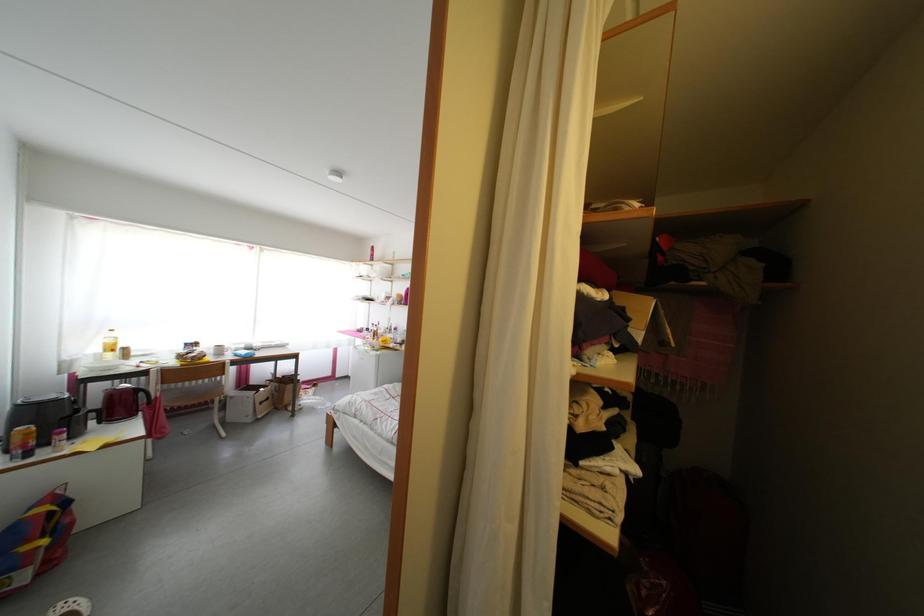
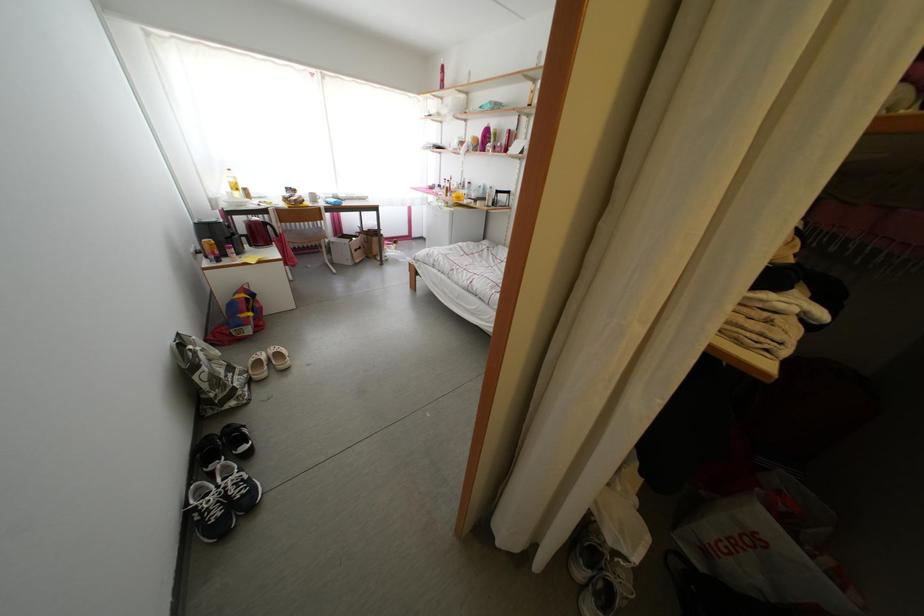
Based on the continuous images, in which direction is the camera rotating?

The camera's rotation is toward left-down.